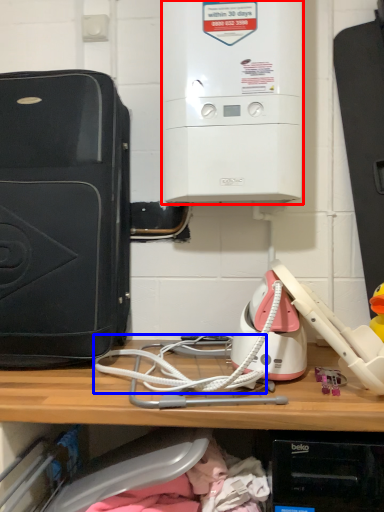
Question: Among these objects, which one is farthest to the camera, home appliance (highlighted by a red box) or wire (highlighted by a blue box)?

Choices:
 (A) home appliance
 (B) wire

Answer: (A)